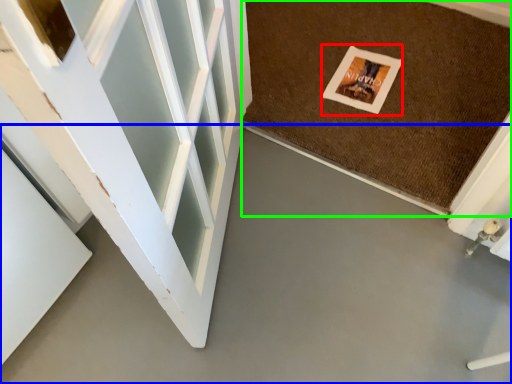
Question: Which object is the closest to the postcard (highlighted by a red box)? Choose among these: concrete (highlighted by a blue box) or mat (highlighted by a green box).

Choices:
 (A) concrete
 (B) mat

Answer: (B)